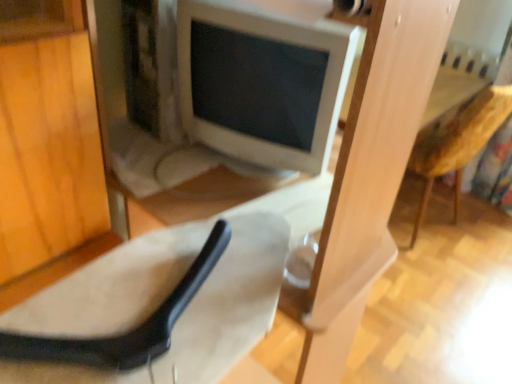
Question: From a real-world perspective, is wooden textured armchair at right above or below suede-like beige chair at lower left?

Choices:
 (A) below
 (B) above

Answer: (A)

Question: Does point (434, 160) appear closer or farther from the camera than point (110, 301)?

Choices:
 (A) farther
 (B) closer

Answer: (A)

Question: Considering the real-world distances, which object is closest to the wooden textured armchair at right?

Choices:
 (A) suede-like beige chair at lower left
 (B) white glossy computer monitor at center

Answer: (B)

Question: Which object is the farthest from the suede-like beige chair at lower left?

Choices:
 (A) wooden textured armchair at right
 (B) white glossy computer monitor at center

Answer: (A)